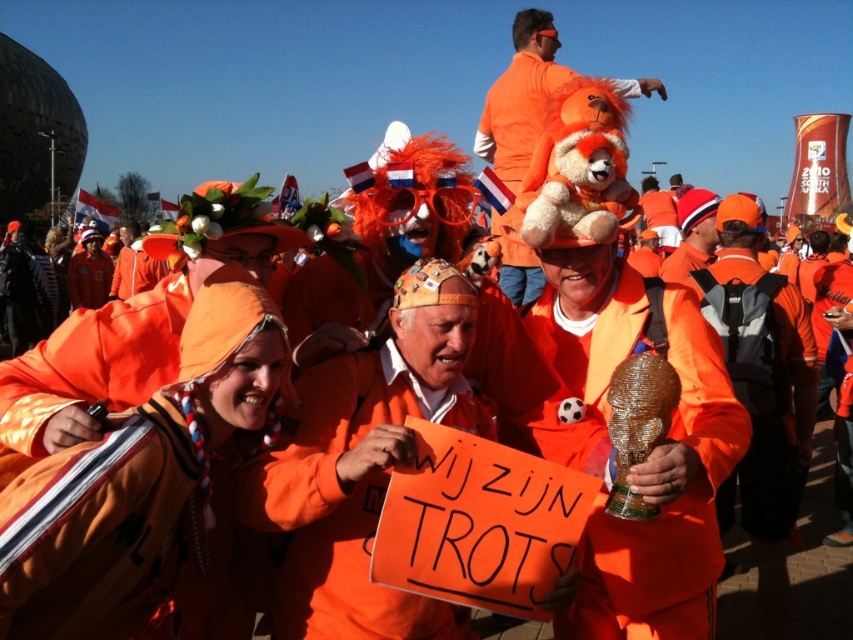
You are a photographer standing at the edge of the crowd. You want to take a photo that includes both the orange matte sign at center and the fluffy orange bear at center. The camera you are using has a maximum focus range of 20 meters. Will both objects be in focus if you position yourself to capture them both?

The orange matte sign at center is 20.48 meters from the fluffy orange bear at center. Since the distance between them exceeds the camera maximum focus range of 20 meters, the camera cannot focus on both objects simultaneously.

You are organizing a photo shoot and need to place the orange matte hat at center and the fluffy orange bear at center on a shelf. The shelf has limited space. Based on the scene, which object should you place first to ensure both fit?

The orange matte hat at center occupies less space than the fluffy orange bear at center, so you should place the fluffy orange bear at center first to ensure both fit on the shelf.